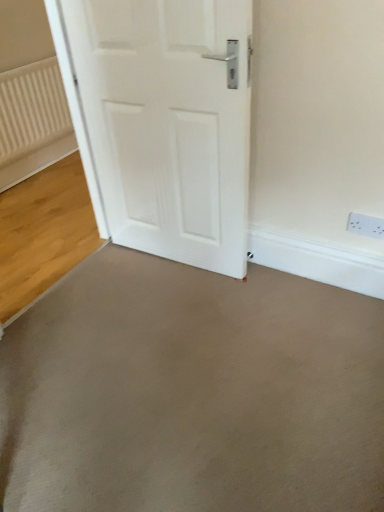
You are a GUI agent. You are given a task and a screenshot of the screen. Output one action in this format:
    pyautogui.click(x=<x>, y=<y>)
    Task: Click on the vacant space situated above gray smooth concrete at center, the 2th concrete viewed from the front (from a real-world perspective)
    This screenshot has width=384, height=512.
    Given the screenshot: What is the action you would take?
    pyautogui.click(x=42, y=214)